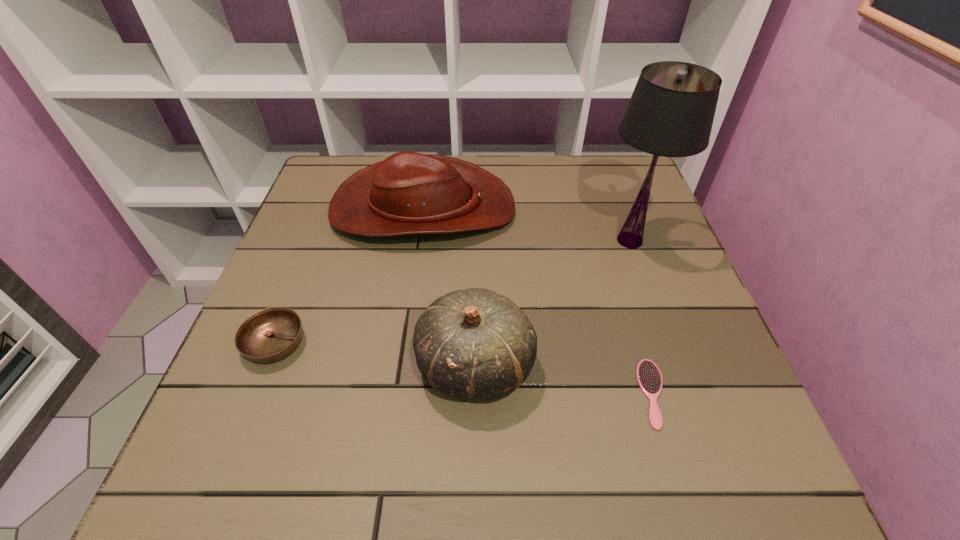
In order to click on vacant space situated on the right of the second shortest object in this screenshot , I will do `click(444, 344)`.

Locate an element on the screen. This screenshot has width=960, height=540. free region located on the right of the hairbrush is located at coordinates (719, 394).

You are a GUI agent. You are given a task and a screenshot of the screen. Output one action in this format:
    pyautogui.click(x=<x>, y=<y>)
    Task: Click on the object situated at the far edge
    This screenshot has width=960, height=540.
    Given the screenshot: What is the action you would take?
    pyautogui.click(x=408, y=193)

At what (x,y) coordinates should I click in order to perform the action: click on cowboy hat situated at the left edge. Please return your answer as a coordinate pair (x, y). The width and height of the screenshot is (960, 540). Looking at the image, I should click on (408, 193).

Where is `soup bowl that is positioned at the left edge`? Image resolution: width=960 pixels, height=540 pixels. soup bowl that is positioned at the left edge is located at coordinates (271, 334).

You are a GUI agent. You are given a task and a screenshot of the screen. Output one action in this format:
    pyautogui.click(x=<x>, y=<y>)
    Task: Click on the lampshade situated at the right edge
    The width and height of the screenshot is (960, 540).
    Given the screenshot: What is the action you would take?
    pyautogui.click(x=671, y=111)

I want to click on hairbrush present at the right edge, so click(x=649, y=378).

Locate an element on the screen. The image size is (960, 540). object present at the far left corner is located at coordinates (408, 193).

This screenshot has width=960, height=540. In the image, there is a desktop. Find the location of `vacant space at the far edge`. vacant space at the far edge is located at coordinates (563, 186).

The image size is (960, 540). Find the location of `free space at the near edge`. free space at the near edge is located at coordinates (513, 448).